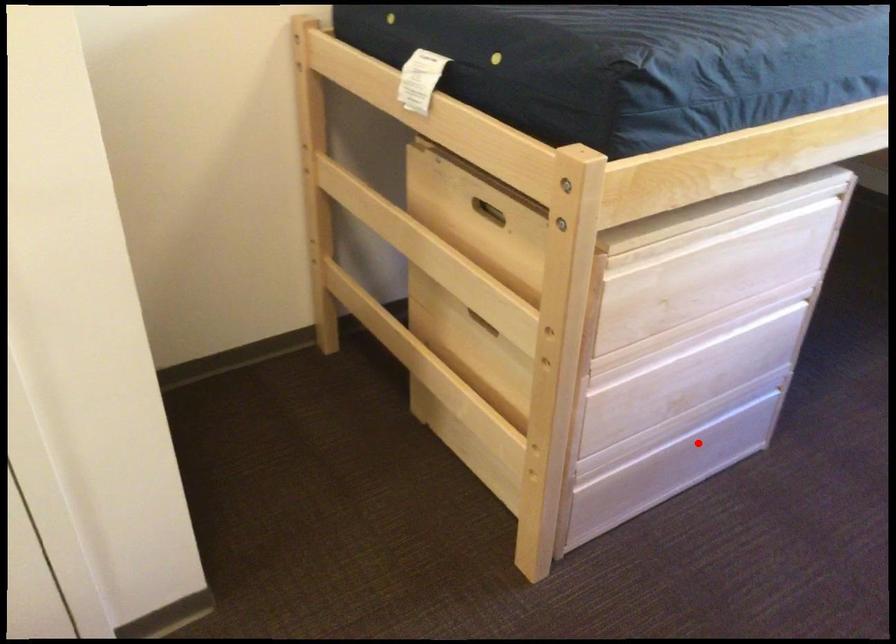
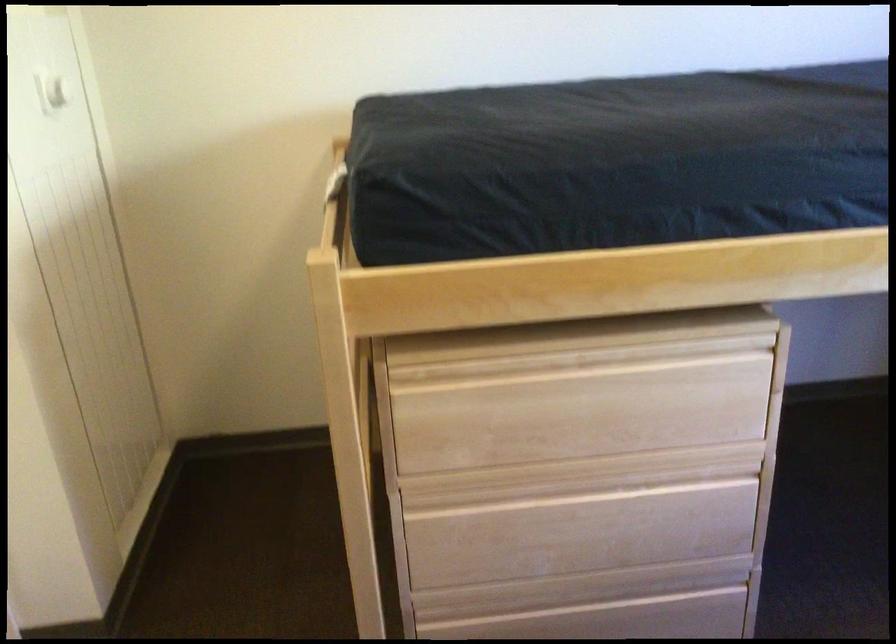
Locate, in the second image, the point that corresponds to the highlighted location in the first image.

(615, 619)